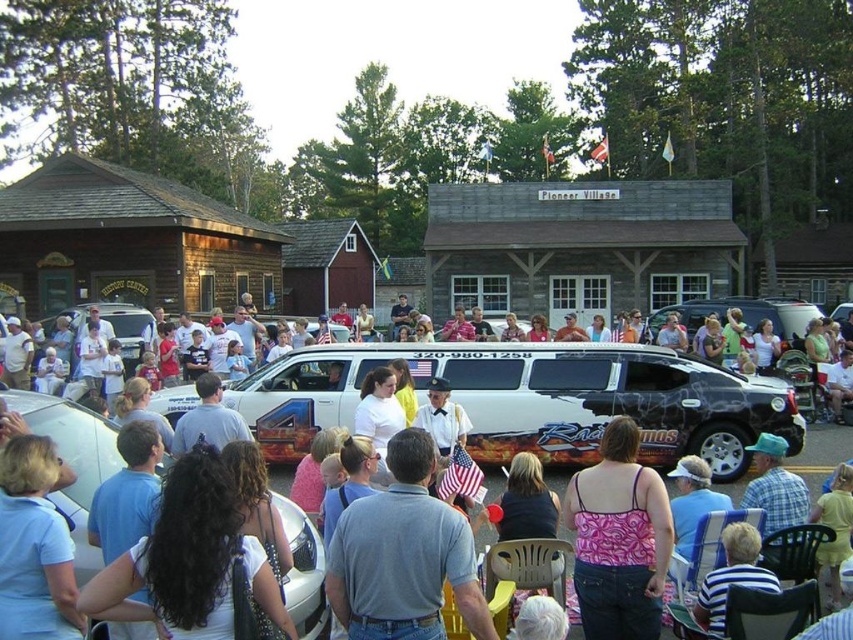
From the picture: You are organizing a parade route and need to know which vehicle takes up more space on the road. Based on the image, which is bigger between the white glossy limousine at center and the white glossy van at center?

The white glossy limousine at center is larger in size compared to the white glossy van at center, so it takes up more space on the road.